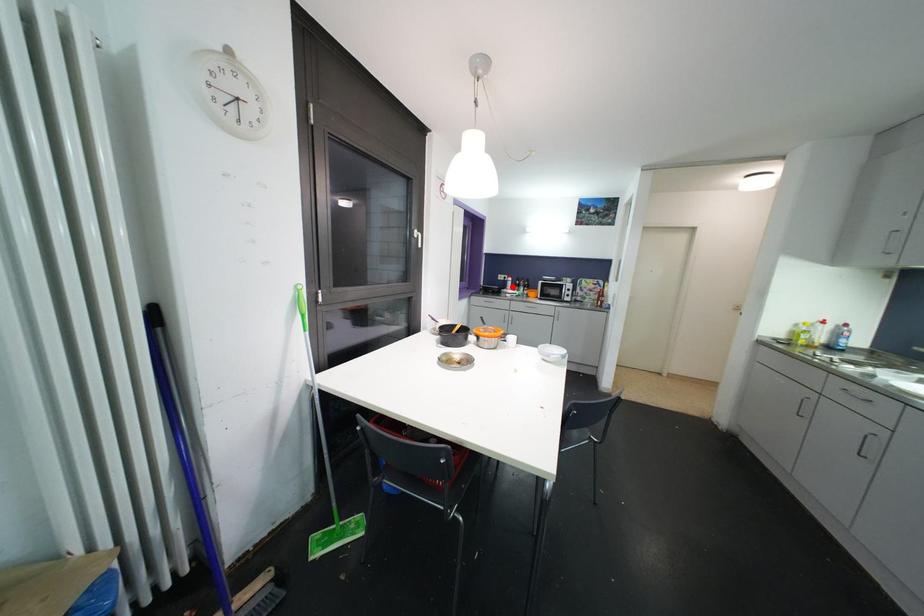
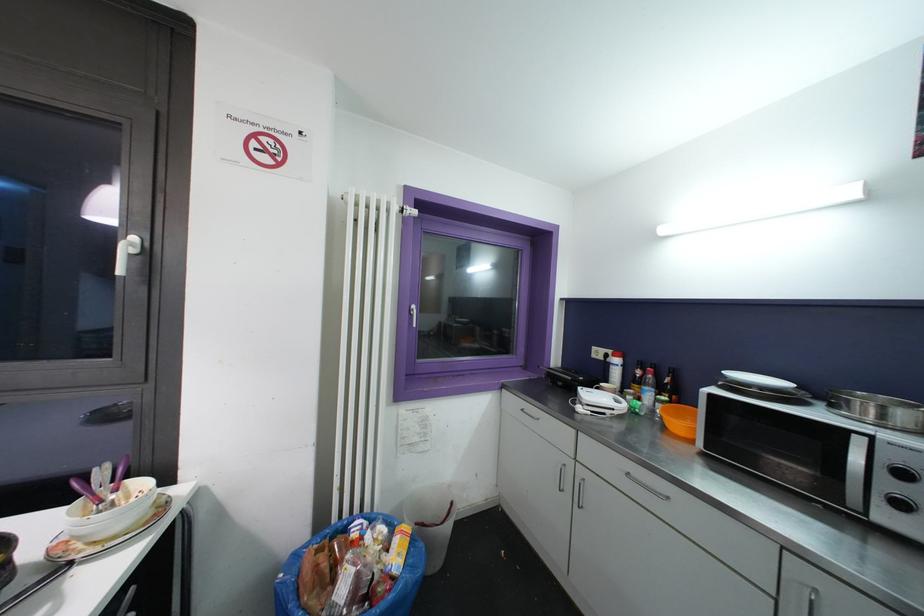
Locate, in the second image, the point that corresponds to the highlighted location in the first image.

(618, 376)